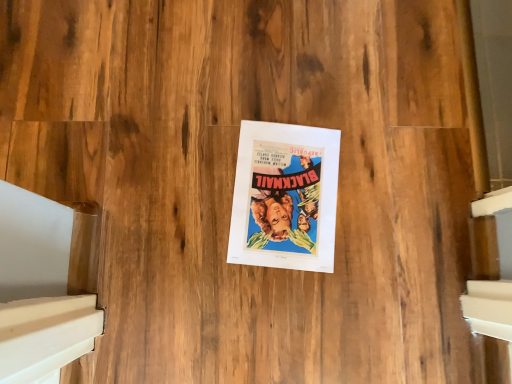
What is the approximate width of matte paper poster at center?

matte paper poster at center is 12.45 inches wide.

Describe the element at coordinates (285, 197) in the screenshot. The image size is (512, 384). I see `matte paper poster at center` at that location.

Identify the location of matte paper poster at center. (285, 197).

You are a GUI agent. You are given a task and a screenshot of the screen. Output one action in this format:
    pyautogui.click(x=<x>, y=<y>)
    Task: Click on the matte paper poster at center
    The width and height of the screenshot is (512, 384).
    Given the screenshot: What is the action you would take?
    pyautogui.click(x=285, y=197)